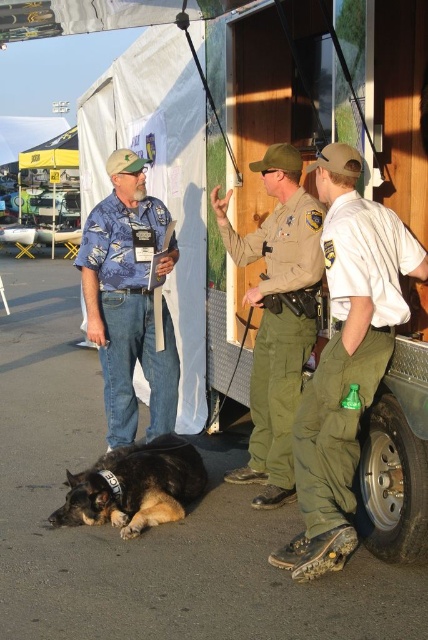
This screenshot has width=428, height=640. Describe the element at coordinates (134, 486) in the screenshot. I see `black fur dog at lower left` at that location.

Which is in front, point (140, 506) or point (422, 470)?

Point (422, 470) is more forward.

Image resolution: width=428 pixels, height=640 pixels. Identify the location of black fur dog at lower left. click(134, 486).

Does point (321, 240) lie in front of point (371, 490)?

Yes.

Between olive green uniform at lower right and metallic silver tire at lower right, which one appears on the right side from the viewer's perspective?

Positioned to the right is metallic silver tire at lower right.

Does point (314, 456) come in front of point (391, 488)?

Yes, it is.

The width and height of the screenshot is (428, 640). In order to click on olive green uniform at lower right in this screenshot , I will do `click(350, 352)`.

Does point (95, 230) come farther from viewer compared to point (410, 465)?

Yes, it is.

Find the location of `blue floral shirt at center`. blue floral shirt at center is located at coordinates (127, 300).